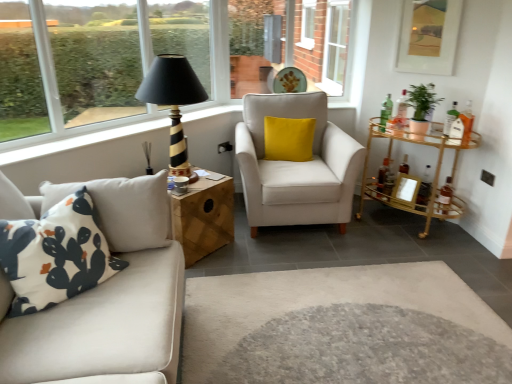
Question: In terms of size, does white printed cushion at left, the second pillow when ordered from top to bottom, appear bigger or smaller than matte gold picture frame at upper right, which ranks as the 1th picture frame in top-to-bottom order?

Choices:
 (A) small
 (B) big

Answer: (B)

Question: Considering their positions, is white printed cushion at left, the 2th pillow in the back-to-front sequence, located in front of or behind matte gold picture frame at upper right, which is the 2th picture frame in bottom-to-top order?

Choices:
 (A) front
 (B) behind

Answer: (A)

Question: Which is farther from the green matte plant at upper right?

Choices:
 (A) wooden cube at center, marked as the 2th table in a right-to-left arrangement
 (B) black striped wood table lamp at upper center
 (C) white glass window at upper right, which ranks as the 2th window in back-to-front order
 (D) gold metallic bar cart at right, which is the 2th table in left-to-right order
 (E) yellow velvet pillow at center, acting as the 2th pillow starting from the front

Answer: (B)

Question: Which of these objects is positioned farthest from the green matte plant at upper right?

Choices:
 (A) gold metallic bar cart at right, positioned as the first table in right-to-left order
 (B) matte gold picture frame at upper right, which ranks as the 1th picture frame in top-to-bottom order
 (C) yellow velvet pillow at center, the 1th pillow from the right
 (D) wooden picture frame at right, acting as the 2th picture frame starting from the top
 (E) black striped wood table lamp at upper center

Answer: (E)